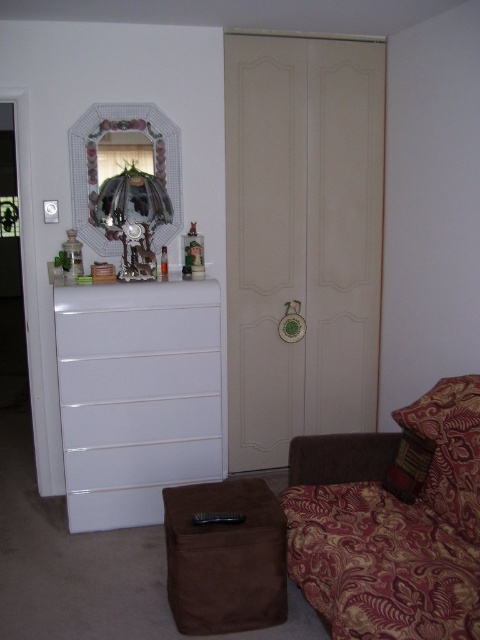
From the picture: Which of these two, beige matte door at center or decorative glass mirror at upper left, stands shorter?

Standing shorter between the two is decorative glass mirror at upper left.

Which is more to the left, beige matte door at center or decorative glass mirror at upper left?

decorative glass mirror at upper left

Is point (228, 380) positioned after point (167, 145)?

Yes, it is behind point (167, 145).

You are a GUI agent. You are given a task and a screenshot of the screen. Output one action in this format:
    pyautogui.click(x=<x>, y=<y>)
    Task: Click on the beige matte door at center
    The width and height of the screenshot is (480, 640).
    Given the screenshot: What is the action you would take?
    pyautogui.click(x=301, y=237)

Is point (131, 348) farther from viewer compared to point (388, 486)?

Yes, it is.

Between point (214, 348) and point (420, 468), which one is positioned in front?

Point (420, 468)

Find the location of `white glossy drawer at left`. white glossy drawer at left is located at coordinates (136, 332).

Is beige matte door at center thinner than white glossy dresser at left?

No.

Is point (333, 122) farther from camera compared to point (103, 420)?

Yes, it is.

Image resolution: width=480 pixels, height=640 pixels. I want to click on beige matte door at center, so click(x=301, y=237).

The height and width of the screenshot is (640, 480). Find the location of `beige matte door at center`. beige matte door at center is located at coordinates (301, 237).